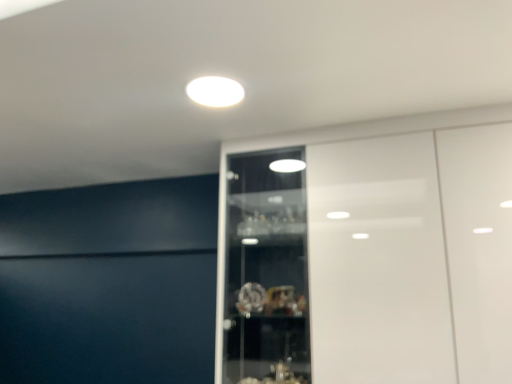
What do you see at coordinates (215, 91) in the screenshot? I see `white glossy light fixture at upper center` at bounding box center [215, 91].

The width and height of the screenshot is (512, 384). What are the coordinates of `white glossy light fixture at upper center` in the screenshot? It's located at (215, 91).

What is the approximate height of white glossy light fixture at upper center?

The height of white glossy light fixture at upper center is 0.74 inches.

Find the location of a particular element. white glossy light fixture at upper center is located at coordinates (215, 91).